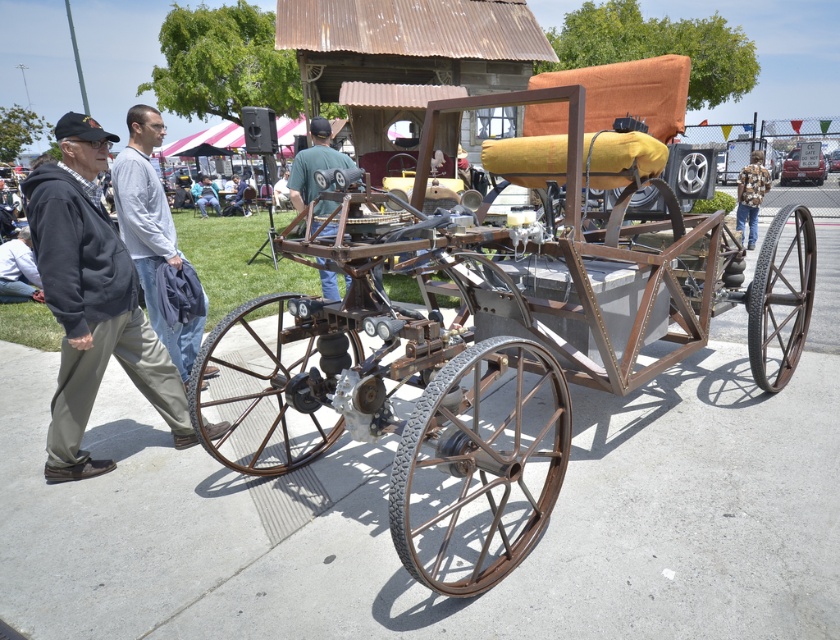
Does light gray sweater at left have a lesser width compared to light blue jeans at lower left?

Correct, light gray sweater at left's width is less than light blue jeans at lower left's.

Can you confirm if light gray sweater at left is bigger than light blue jeans at lower left?

No.

The height and width of the screenshot is (640, 840). I want to click on light gray sweater at left, so click(x=151, y=230).

Locate an element on the screen. The height and width of the screenshot is (640, 840). light gray sweater at left is located at coordinates (151, 230).

Measure the distance between point (329, 154) and camera.

They are 6.25 meters apart.

Is green matte shirt at center shorter than floral-patterned shirt at center?

Yes, green matte shirt at center is shorter than floral-patterned shirt at center.

Between point (319, 259) and point (739, 177), which one is positioned in front?

Point (319, 259)

This screenshot has height=640, width=840. Identify the location of green matte shirt at center. (313, 163).

Based on the photo, is dark gray hoodie at left below light gray sweater at left?

Correct, dark gray hoodie at left is located below light gray sweater at left.

Is point (147, 387) positioned before point (177, 371)?

Yes, it is in front of point (177, 371).

The image size is (840, 640). I want to click on dark gray hoodie at left, so click(x=92, y=300).